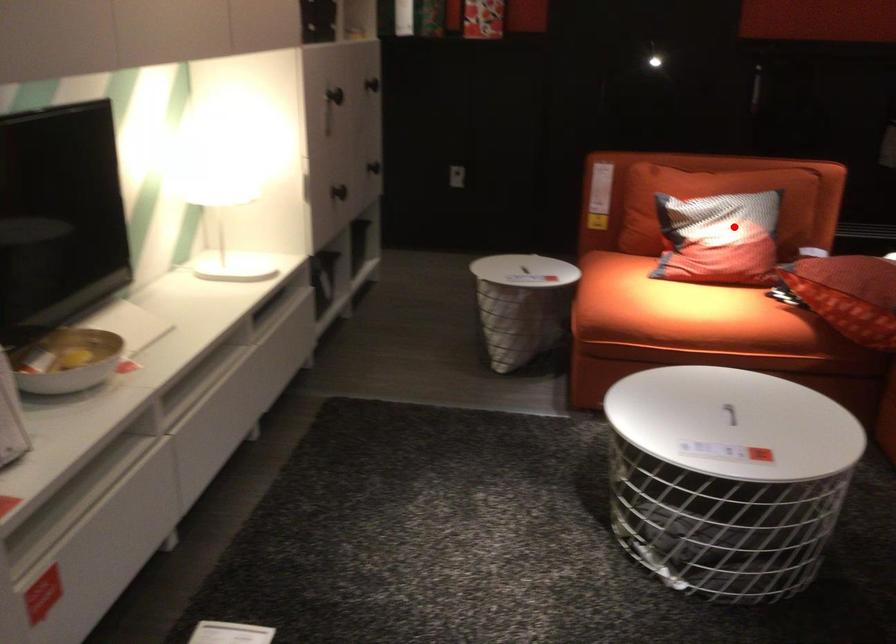
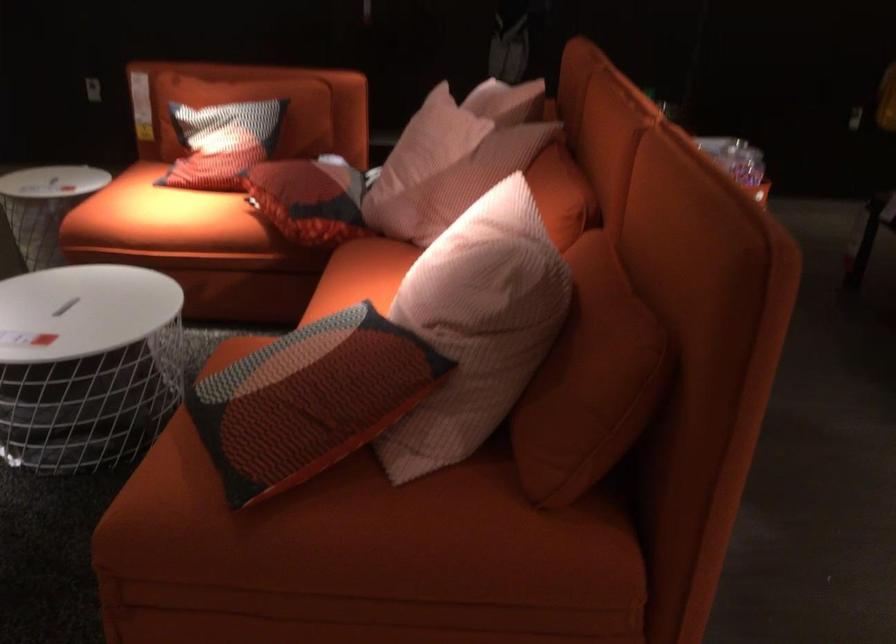
Find the pixel in the second image that matches the highlighted location in the first image.

(222, 142)